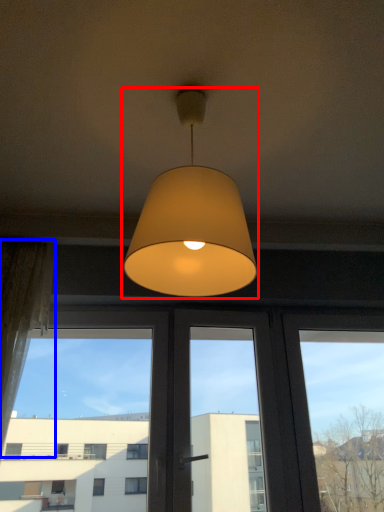
Question: Which point is further to the camera, lamp (highlighted by a red box) or curtain (highlighted by a blue box)?

Choices:
 (A) lamp
 (B) curtain

Answer: (B)